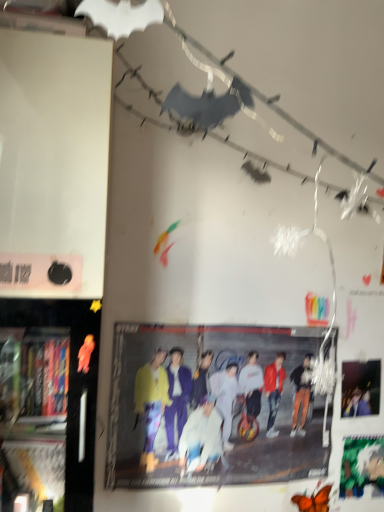
The image size is (384, 512). What do you see at coordinates (362, 466) in the screenshot?
I see `green matte poster at lower right, which is the first poster page from bottom to top` at bounding box center [362, 466].

Identify the location of matte black poster at upper right, the 2th poster page when ordered from bottom to top. Image resolution: width=384 pixels, height=512 pixels. (360, 388).

Find the location of a particular element. The image size is (384, 512). matte yellow jacket at center is located at coordinates (175, 373).

You are a GUI agent. You are given a task and a screenshot of the screen. Output one action in this format:
    pyautogui.click(x=<x>, y=<y>)
    Task: Click on the bookshelf above the matte black poster at upper right, the first poster page viewed from the top (from a real-world perspective)
    
    Given the screenshot: What is the action you would take?
    pyautogui.click(x=34, y=411)

Measure the distance between black plastic bookshelf at left and matte black poster at upper right, the 2th poster page when ordered from bottom to top.

The distance of black plastic bookshelf at left from matte black poster at upper right, the 2th poster page when ordered from bottom to top, is 1.01 meters.

From a real-world perspective, is black plastic bookshelf at left below matte black poster at upper right, the 2th poster page when ordered from bottom to top?

No, from a real-world perspective, black plastic bookshelf at left is not beneath matte black poster at upper right, the 2th poster page when ordered from bottom to top.

Can you confirm if black plastic bookshelf at left is taller than matte black poster at upper right, the first poster page viewed from the top?

Indeed, black plastic bookshelf at left has a greater height compared to matte black poster at upper right, the first poster page viewed from the top.

Is point (246, 421) more distant than point (345, 490)?

That is False.

Locate an element on the screen. Image resolution: width=384 pixels, height=512 pixels. poster page below the matte yellow jacket at center (from the image's perspective) is located at coordinates click(x=362, y=466).

From the image's perspective, which is below, matte yellow jacket at center or green matte poster at lower right, which is the first poster page from bottom to top?

From the image's view, green matte poster at lower right, which is the first poster page from bottom to top, is below.

Between matte yellow jacket at center and green matte poster at lower right, which is the first poster page from bottom to top, which one has smaller width?

Thinner between the two is green matte poster at lower right, which is the first poster page from bottom to top.

Consider the image. Considering the relative sizes of green matte poster at lower right, which is the first poster page from bottom to top, and black plastic bookshelf at left in the image provided, is green matte poster at lower right, which is the first poster page from bottom to top, taller than black plastic bookshelf at left?

In fact, green matte poster at lower right, which is the first poster page from bottom to top, may be shorter than black plastic bookshelf at left.

Looking at this image, do you think green matte poster at lower right, which is the first poster page from bottom to top, is within black plastic bookshelf at left, or outside of it?

green matte poster at lower right, which is the first poster page from bottom to top, is located beyond the bounds of black plastic bookshelf at left.

Does green matte poster at lower right, arranged as the 2th poster page when viewed from the top, touch black plastic bookshelf at left?

No.

Is green matte poster at lower right, which is the first poster page from bottom to top, wider than black plastic bookshelf at left?

No, green matte poster at lower right, which is the first poster page from bottom to top, is not wider than black plastic bookshelf at left.

Is matte black poster at upper right, the first poster page viewed from the top, thinner than matte yellow jacket at center?

Yes.

From the image's perspective, which one is positioned lower, matte black poster at upper right, the first poster page viewed from the top, or matte yellow jacket at center?

matte yellow jacket at center appears lower in the image.

Is matte black poster at upper right, the first poster page viewed from the top, beside matte yellow jacket at center?

No, matte black poster at upper right, the first poster page viewed from the top, is not beside matte yellow jacket at center.

From their relative heights in the image, would you say matte black poster at upper right, the 2th poster page when ordered from bottom to top, is taller or shorter than matte yellow jacket at center?

In the image, matte black poster at upper right, the 2th poster page when ordered from bottom to top, appears to be shorter than matte yellow jacket at center.

Between green matte poster at lower right, arranged as the 2th poster page when viewed from the top, and matte black poster at upper right, the first poster page viewed from the top, which one has smaller size?

matte black poster at upper right, the first poster page viewed from the top.

Considering the sizes of objects green matte poster at lower right, arranged as the 2th poster page when viewed from the top, and matte black poster at upper right, the first poster page viewed from the top, in the image provided, who is wider, green matte poster at lower right, arranged as the 2th poster page when viewed from the top, or matte black poster at upper right, the first poster page viewed from the top,?

Wider between the two is matte black poster at upper right, the first poster page viewed from the top.

From a real-world perspective, which object rests below the other?

green matte poster at lower right, arranged as the 2th poster page when viewed from the top, from a real-world perspective.

In terms of height, does green matte poster at lower right, which is the first poster page from bottom to top, look taller or shorter compared to matte black poster at upper right, the 2th poster page when ordered from bottom to top?

In the image, green matte poster at lower right, which is the first poster page from bottom to top, appears to be taller than matte black poster at upper right, the 2th poster page when ordered from bottom to top.

Considering the relative sizes of black plastic bookshelf at left and matte yellow jacket at center in the image provided, is black plastic bookshelf at left smaller than matte yellow jacket at center?

Incorrect, black plastic bookshelf at left is not smaller in size than matte yellow jacket at center.

From the image's perspective, between black plastic bookshelf at left and matte yellow jacket at center, who is located below?

matte yellow jacket at center.

Is black plastic bookshelf at left wider or thinner than matte yellow jacket at center?

black plastic bookshelf at left is wider than matte yellow jacket at center.

Based on their positions, is black plastic bookshelf at left located to the left or right of matte yellow jacket at center?

black plastic bookshelf at left is positioned on matte yellow jacket at center's left side.

Are black plastic bookshelf at left and green matte poster at lower right, arranged as the 2th poster page when viewed from the top, located far from each other?

Yes, black plastic bookshelf at left and green matte poster at lower right, arranged as the 2th poster page when viewed from the top, are located far from each other.

Is black plastic bookshelf at left to the left of green matte poster at lower right, which is the first poster page from bottom to top, from the viewer's perspective?

Indeed, black plastic bookshelf at left is positioned on the left side of green matte poster at lower right, which is the first poster page from bottom to top.

Is black plastic bookshelf at left turned away from green matte poster at lower right, which is the first poster page from bottom to top?

No, green matte poster at lower right, which is the first poster page from bottom to top, is not at the back of black plastic bookshelf at left.

From the image's perspective, relative to green matte poster at lower right, arranged as the 2th poster page when viewed from the top, is black plastic bookshelf at left above or below?

Clearly, from the image's perspective, black plastic bookshelf at left is above green matte poster at lower right, arranged as the 2th poster page when viewed from the top.

Find the location of a particular element. Image resolution: width=384 pixels, height=512 pixels. the 1st poster page positioned below the black plastic bookshelf at left (from the image's perspective) is located at coordinates (360, 388).

Identify the location of the 2nd poster page behind the matte yellow jacket at center, starting your count from the anchor. The image size is (384, 512). (362, 466).

From the image, which object appears to be nearer to black plastic bookshelf at left, matte black poster at upper right, the 2th poster page when ordered from bottom to top, or matte yellow jacket at center?

matte yellow jacket at center.

Based on their spatial positions, is matte yellow jacket at center or black plastic bookshelf at left closer to green matte poster at lower right, which is the first poster page from bottom to top?

matte yellow jacket at center is positioned closer to the anchor green matte poster at lower right, which is the first poster page from bottom to top.

From the image, which object appears to be farther from matte black poster at upper right, the 2th poster page when ordered from bottom to top, green matte poster at lower right, which is the first poster page from bottom to top, or matte yellow jacket at center?

The object further to matte black poster at upper right, the 2th poster page when ordered from bottom to top, is matte yellow jacket at center.

Which object lies further to the anchor point matte yellow jacket at center, green matte poster at lower right, which is the first poster page from bottom to top, or black plastic bookshelf at left?

green matte poster at lower right, which is the first poster page from bottom to top, is further to matte yellow jacket at center.

From the image, which object appears to be nearer to matte yellow jacket at center, black plastic bookshelf at left or matte black poster at upper right, the 2th poster page when ordered from bottom to top?

Based on the image, matte black poster at upper right, the 2th poster page when ordered from bottom to top, appears to be nearer to matte yellow jacket at center.

When comparing their distances from matte black poster at upper right, the 2th poster page when ordered from bottom to top, does matte yellow jacket at center or black plastic bookshelf at left seem further?

black plastic bookshelf at left lies further to matte black poster at upper right, the 2th poster page when ordered from bottom to top, than the other object.

Based on their spatial positions, is matte yellow jacket at center or matte black poster at upper right, the first poster page viewed from the top, closer to green matte poster at lower right, arranged as the 2th poster page when viewed from the top?

Result: matte black poster at upper right, the first poster page viewed from the top.

Based on their spatial positions, is green matte poster at lower right, arranged as the 2th poster page when viewed from the top, or matte black poster at upper right, the 2th poster page when ordered from bottom to top, further from black plastic bookshelf at left?

green matte poster at lower right, arranged as the 2th poster page when viewed from the top, is further to black plastic bookshelf at left.

In order to click on poster page between black plastic bookshelf at left and green matte poster at lower right, which is the first poster page from bottom to top in this screenshot , I will do `click(360, 388)`.

Locate an element on the screen. person between black plastic bookshelf at left and matte black poster at upper right, the 2th poster page when ordered from bottom to top, from left to right is located at coordinates (175, 373).

Image resolution: width=384 pixels, height=512 pixels. I want to click on poster page located between matte yellow jacket at center and green matte poster at lower right, arranged as the 2th poster page when viewed from the top, in the left-right direction, so click(360, 388).

Find the location of a particular element. person situated between black plastic bookshelf at left and green matte poster at lower right, arranged as the 2th poster page when viewed from the top, from left to right is located at coordinates (175, 373).